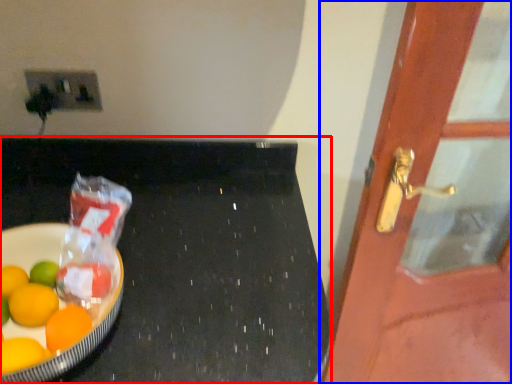
Question: Which object is closer to the camera taking this photo, table (highlighted by a red box) or door (highlighted by a blue box)?

Choices:
 (A) table
 (B) door

Answer: (A)